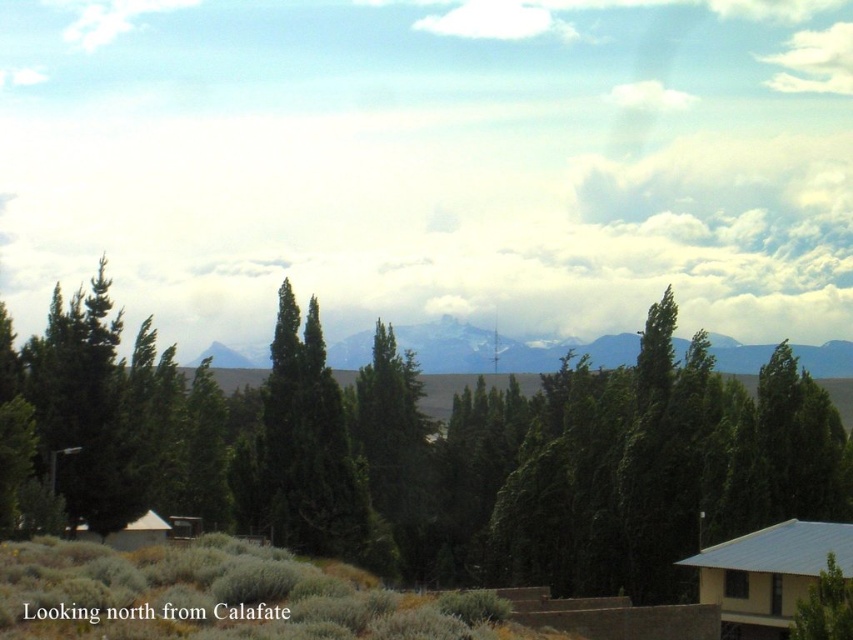
Question: Is green matte tree at left further to camera compared to snowy granite mountain at center?

Choices:
 (A) no
 (B) yes

Answer: (A)

Question: Does green leafy tree at center have a larger size compared to snowy granite mountain at center?

Choices:
 (A) no
 (B) yes

Answer: (A)

Question: Which object is farther from the camera taking this photo?

Choices:
 (A) snowy granite mountain at center
 (B) green matte tree at left
 (C) green leafy tree at center

Answer: (A)

Question: Which point is closer to the camera?

Choices:
 (A) (354, 540)
 (B) (154, 333)

Answer: (A)

Question: Which point is closer to the camera?

Choices:
 (A) snowy granite mountain at center
 (B) green leafy tree at center

Answer: (B)

Question: Does green matte tree at left appear on the left side of snowy granite mountain at center?

Choices:
 (A) no
 (B) yes

Answer: (B)